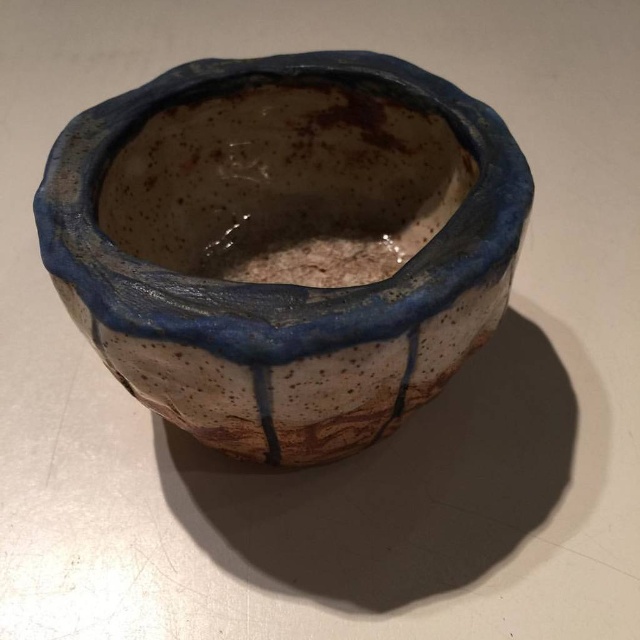
Question: Which point is closer to the camera?

Choices:
 (A) speckled ceramic pot at center
 (B) speckled clay pot at center

Answer: (A)

Question: Which point appears closest to the camera in this image?

Choices:
 (A) (404, 148)
 (B) (220, 269)

Answer: (A)

Question: Which object appears closest to the camera in this image?

Choices:
 (A) speckled ceramic pot at center
 (B) speckled clay pot at center

Answer: (A)

Question: Does speckled ceramic pot at center appear on the left side of speckled clay pot at center?

Choices:
 (A) no
 (B) yes

Answer: (B)

Question: Does speckled ceramic pot at center appear over speckled clay pot at center?

Choices:
 (A) no
 (B) yes

Answer: (A)

Question: Does speckled ceramic pot at center appear on the right side of speckled clay pot at center?

Choices:
 (A) no
 (B) yes

Answer: (A)